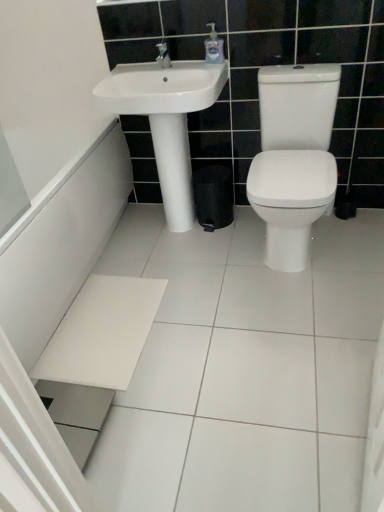
The width and height of the screenshot is (384, 512). What are the coordinates of `vacant area on top of white ceramic tile at lower center (from a real-world perspective)` in the screenshot? It's located at (222, 313).